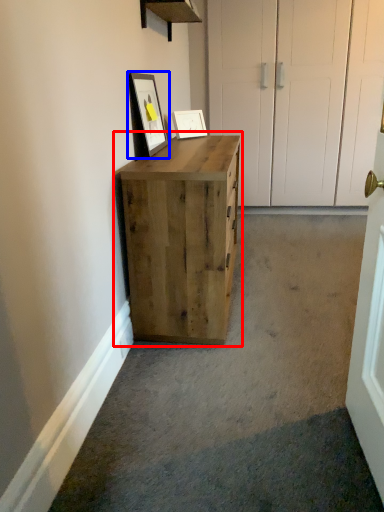
Question: Which object appears closest to the camera in this image, chest of drawers (highlighted by a red box) or picture frame (highlighted by a blue box)?

Choices:
 (A) chest of drawers
 (B) picture frame

Answer: (A)